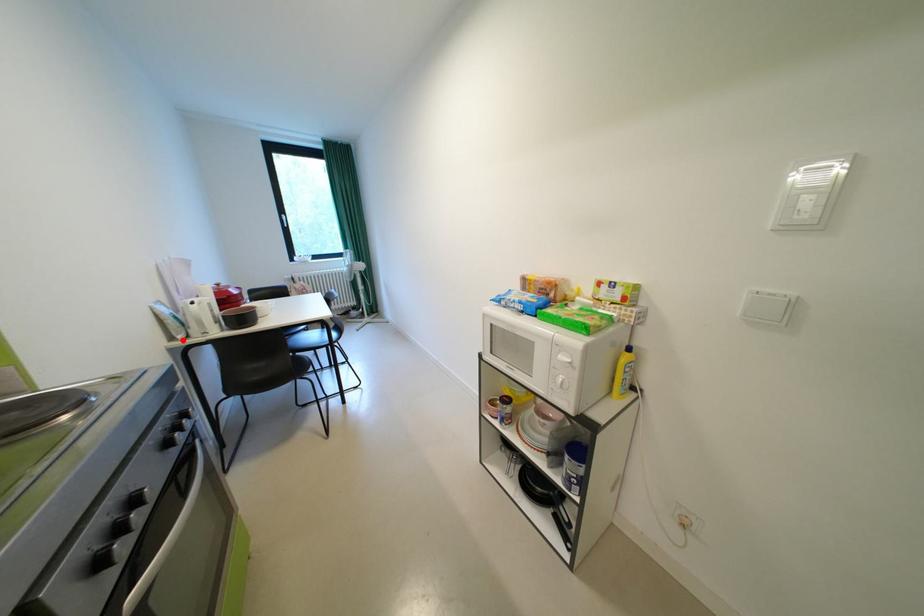
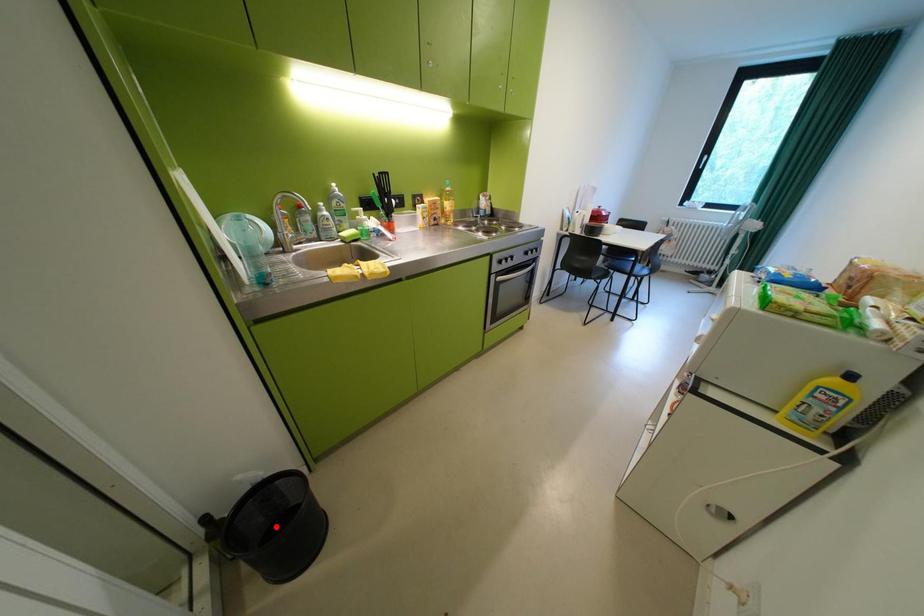
I am providing you with two images of the same scene from different viewpoints. A red point is marked on the first image and another point is marked on the second image. Is the red point in image1 aligned with the point shown in image2?

No